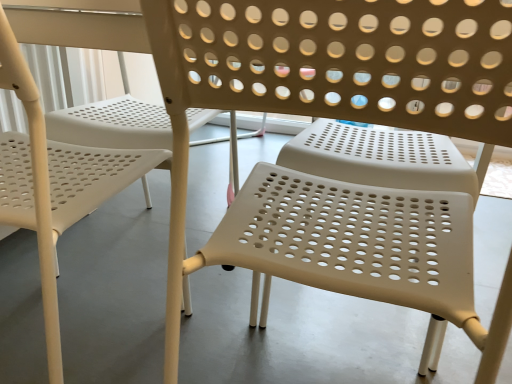
Question: In terms of size, does white plastic chair at center, the second chair viewed from the right, appear bigger or smaller than beige plastic chair at center, the 2th chair positioned from the left?

Choices:
 (A) big
 (B) small

Answer: (A)

Question: From a real-world perspective, is white plastic chair at center, the second chair viewed from the right, positioned above or below beige plastic chair at center, the 2th chair positioned from the left?

Choices:
 (A) above
 (B) below

Answer: (B)

Question: Considering the positions of white plastic chair at center, the second chair viewed from the right, and beige plastic chair at center, the 2th chair positioned from the left, in the image, is white plastic chair at center, the second chair viewed from the right, wider or thinner than beige plastic chair at center, the 2th chair positioned from the left,?

Choices:
 (A) wide
 (B) thin

Answer: (A)

Question: From the image's perspective, is beige plastic chair at center, the first chair viewed from the right, positioned above or below white plastic chair at center, the second chair viewed from the right?

Choices:
 (A) below
 (B) above

Answer: (A)

Question: Visually, is beige plastic chair at center, the first chair viewed from the right, positioned to the left or to the right of white plastic chair at center, the second chair viewed from the right?

Choices:
 (A) right
 (B) left

Answer: (A)

Question: Is point (474, 87) positioned closer to the camera than point (6, 16)?

Choices:
 (A) farther
 (B) closer

Answer: (B)

Question: Looking at their shapes, would you say beige plastic chair at center, the 2th chair positioned from the left, is wider or thinner than white plastic chair at center, the second chair viewed from the right?

Choices:
 (A) thin
 (B) wide

Answer: (A)